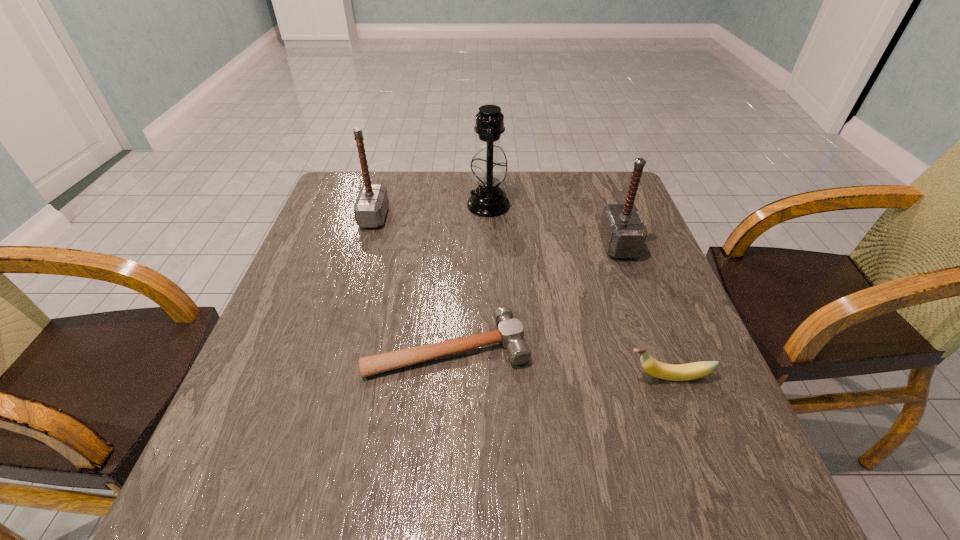
Find the location of a particular element. vacant area that lies between the leftmost hammer and the shortest object is located at coordinates (411, 281).

Where is `vacant space that is in between the second hammer from left to right and the leftmost hammer`? This screenshot has width=960, height=540. vacant space that is in between the second hammer from left to right and the leftmost hammer is located at coordinates [411, 281].

This screenshot has width=960, height=540. I want to click on free space between the leftmost object and the rightmost hammer, so click(x=496, y=231).

The width and height of the screenshot is (960, 540). Find the location of `free space between the oil lamp and the rightmost hammer`. free space between the oil lamp and the rightmost hammer is located at coordinates (553, 225).

Find the location of a particular element. The height and width of the screenshot is (540, 960). free space between the leftmost object and the banana is located at coordinates (520, 296).

Identify which object is the second nearest to the shortest hammer. Please provide its 2D coordinates. Your answer should be formatted as a tuple, i.e. [(x, y)], where the tuple contains the x and y coordinates of a point satisfying the conditions above.

[(623, 232)]

Identify the location of object that stands as the second closest to the rightmost hammer. (510, 333).

Select which hammer appears as the closest to the leftmost hammer. Please provide its 2D coordinates. Your answer should be formatted as a tuple, i.e. [(x, y)], where the tuple contains the x and y coordinates of a point satisfying the conditions above.

[(510, 333)]

Identify the location of hammer that is the second closest one to the rightmost hammer. (370, 208).

Identify the location of free space that satisfies the following two spatial constraints: 1. on the striking surface of the leftmost hammer; 2. on the right side of the second hammer from right to left. This screenshot has width=960, height=540. coord(335,346).